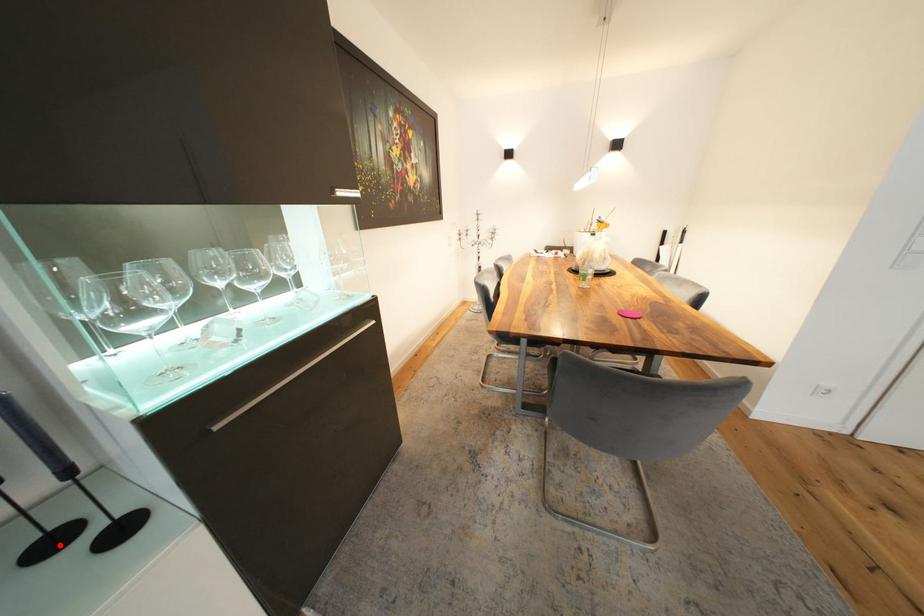
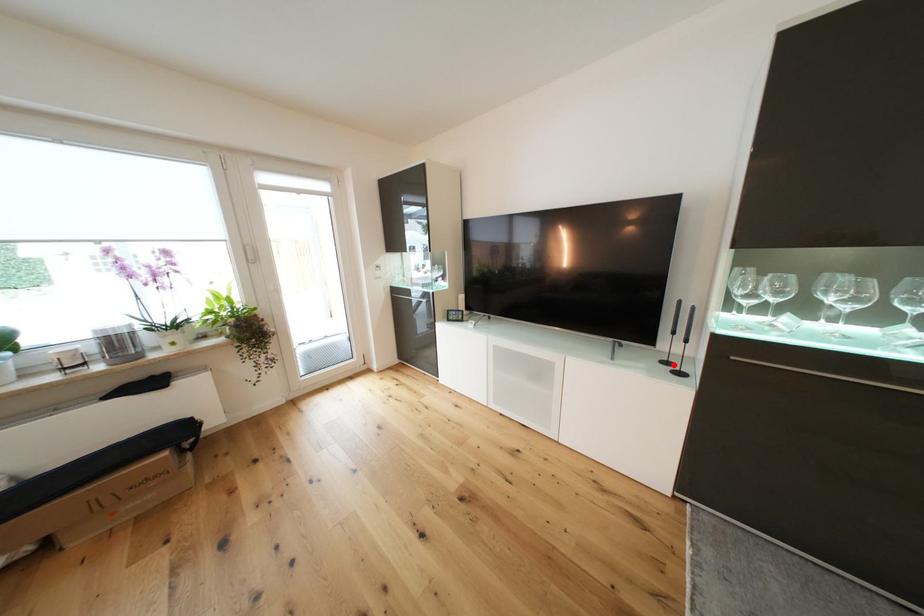
I am providing you with two images of the same scene from different viewpoints. A red point is marked on the first image and another point is marked on the second image. Does the point marked in image1 correspond to the same location as the one in image2?

Yes